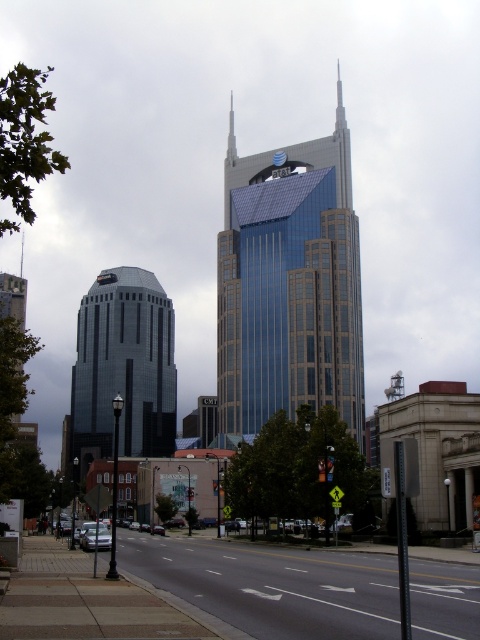
Question: Is shiny glass skyscraper at left thinner than metallic silver spire at center?

Choices:
 (A) yes
 (B) no

Answer: (B)

Question: In this image, where is shiny glass skyscraper at center located relative to shiny glass skyscraper at left?

Choices:
 (A) left
 (B) right

Answer: (B)

Question: Among these objects, which one is nearest to the camera?

Choices:
 (A) smooth silver spire at upper center
 (B) shiny glass skyscraper at center
 (C) shiny glass skyscraper at left
 (D) metallic silver spire at center

Answer: (B)

Question: Which point is closer to the camera taking this photo?

Choices:
 (A) (112, 291)
 (B) (21, 275)
 (C) (280, 316)

Answer: (C)

Question: Which point is closer to the camera?

Choices:
 (A) (20, 262)
 (B) (222, 410)
 (C) (143, 320)
 (D) (232, 150)

Answer: (B)

Question: Can you confirm if shiny glass skyscraper at center is smaller than smooth silver spire at upper center?

Choices:
 (A) no
 (B) yes

Answer: (A)